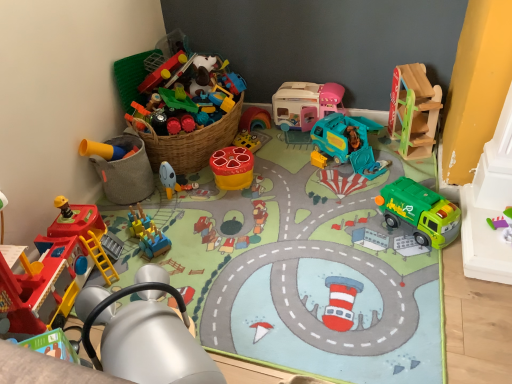
Where is `free space to the left of wooden slide at upper right, marked as the ninth toy in a left-to-right arrangement`? free space to the left of wooden slide at upper right, marked as the ninth toy in a left-to-right arrangement is located at coordinates (382, 152).